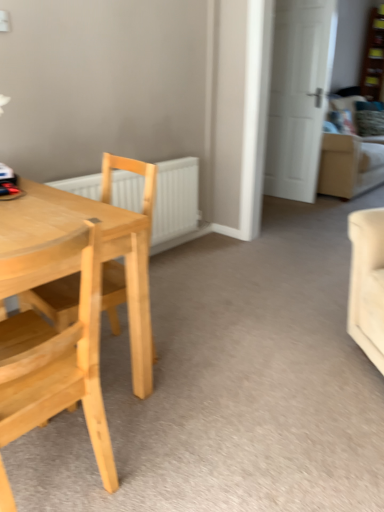
Describe the element at coordinates (63, 373) in the screenshot. I see `light wood chair at left, the 1th chair from the front` at that location.

Locate an element on the screen. beige fabric couch at upper right is located at coordinates (350, 159).

The width and height of the screenshot is (384, 512). What do you see at coordinates (350, 159) in the screenshot? I see `beige fabric couch at upper right` at bounding box center [350, 159].

At what (x,y) coordinates should I click in order to perform the action: click on light wood chair at left, the 1th chair from the front. Please return your answer as a coordinate pair (x, y). This screenshot has width=384, height=512. Looking at the image, I should click on (63, 373).

Is wooden bookshelf at upper right far away from white matte radiator at center?

Indeed, wooden bookshelf at upper right is not near white matte radiator at center.

Image resolution: width=384 pixels, height=512 pixels. Find the location of `radiator in front of the wooden bookshelf at upper right`. radiator in front of the wooden bookshelf at upper right is located at coordinates (175, 199).

Considering the relative sizes of wooden bookshelf at upper right and white matte radiator at center in the image provided, is wooden bookshelf at upper right thinner than white matte radiator at center?

No, wooden bookshelf at upper right is not thinner than white matte radiator at center.

Does wooden bookshelf at upper right have a lesser height compared to white matte radiator at center?

In fact, wooden bookshelf at upper right may be taller than white matte radiator at center.

Which object is wider, natural wood chair at left, positioned as the 1th chair in back-to-front order, or white matte radiator at center?

natural wood chair at left, positioned as the 1th chair in back-to-front order, is wider.

Could you measure the distance between natural wood chair at left, which is the second chair in front-to-back order, and white matte radiator at center?

They are 1.40 meters apart.

Which is behind, natural wood chair at left, which is the second chair in front-to-back order, or white matte radiator at center?

white matte radiator at center.

From the image's perspective, which object appears higher, natural wood chair at left, which is the second chair in front-to-back order, or white matte radiator at center?

white matte radiator at center.

Which is behind, point (307, 91) or point (352, 136)?

The point (352, 136) is behind.

Could beige fabric couch at upper right be considered to be inside white matte door at upper right?

Definitely not — beige fabric couch at upper right is not inside white matte door at upper right.

You are a GUI agent. You are given a task and a screenshot of the screen. Output one action in this format:
    pyautogui.click(x=<x>, y=<y>)
    Task: Click on the couch below the white matte door at upper right (from the image's perspective)
    
    Given the screenshot: What is the action you would take?
    pyautogui.click(x=350, y=159)

From the image's perspective, which is below, light wood chair at left, the 1th chair from the front, or wooden bookshelf at upper right?

light wood chair at left, the 1th chair from the front, is shown below in the image.

Measure the distance between light wood chair at left, the second chair viewed from the back, and wooden bookshelf at upper right.

A distance of 18.60 feet exists between light wood chair at left, the second chair viewed from the back, and wooden bookshelf at upper right.

Which of these two, light wood chair at left, the second chair viewed from the back, or wooden bookshelf at upper right, is smaller?

wooden bookshelf at upper right is smaller.

Would you say light wood chair at left, the 1th chair from the front, is to the left or to the right of wooden bookshelf at upper right in the picture?

light wood chair at left, the 1th chair from the front, is to the left of wooden bookshelf at upper right.

Is natural wood chair at left, positioned as the 1th chair in back-to-front order, not inside light wood chair at left, the second chair viewed from the back?

Absolutely, natural wood chair at left, positioned as the 1th chair in back-to-front order, is external to light wood chair at left, the second chair viewed from the back.

Is point (118, 270) less distant than point (96, 268)?

That is False.

Is natural wood chair at left, which is the second chair in front-to-back order, behind light wood chair at left, the 1th chair from the front?

Yes, natural wood chair at left, which is the second chair in front-to-back order, is further from the viewer.

Does point (82, 191) lie in front of point (325, 30)?

Yes, point (82, 191) is in front of point (325, 30).

Measure the distance between white matte radiator at center and white matte door at upper right.

white matte radiator at center and white matte door at upper right are 4.99 feet apart from each other.

From a real-world perspective, is white matte radiator at center on top of white matte door at upper right?

No, from a real-world perspective, white matte radiator at center is not over white matte door at upper right

Is white matte radiator at center shorter than white matte door at upper right?

Correct, white matte radiator at center is not as tall as white matte door at upper right.

Which of these two, white matte radiator at center or light wood chair at left, the 1th chair from the front, stands taller?

light wood chair at left, the 1th chair from the front.

Is white matte radiator at center not inside light wood chair at left, the 1th chair from the front?

white matte radiator at center lies outside light wood chair at left, the 1th chair from the front,'s area.

Is white matte radiator at center far from light wood chair at left, the 1th chair from the front?

white matte radiator at center is far away from light wood chair at left, the 1th chair from the front.

Consider the image. Which is more to the left, white matte radiator at center or light wood chair at left, the 1th chair from the front?

From the viewer's perspective, light wood chair at left, the 1th chair from the front, appears more on the left side.

You are a GUI agent. You are given a task and a screenshot of the screen. Output one action in this format:
    pyautogui.click(x=<x>, y=<y>)
    Task: Click on the shelf to the right of white matte radiator at center
    The image size is (384, 512).
    Given the screenshot: What is the action you would take?
    pyautogui.click(x=373, y=57)

Locate an element on the screen. chair that is the 1st one when counting downward from the white matte radiator at center (from the image's perspective) is located at coordinates (56, 300).

From the image, which object appears to be farther from white matte door at upper right, light wood chair at left, the 1th chair from the front, or white matte radiator at center?

The object further to white matte door at upper right is light wood chair at left, the 1th chair from the front.

Considering their positions, is wooden bookshelf at upper right positioned further to beige fabric couch at upper right than light wood chair at left, the 1th chair from the front?

Among the two, light wood chair at left, the 1th chair from the front, is located further to beige fabric couch at upper right.

From the image, which object appears to be nearer to wooden bookshelf at upper right, light wood chair at left, the 1th chair from the front, or natural wood chair at left, which is the second chair in front-to-back order?

natural wood chair at left, which is the second chair in front-to-back order, lies closer to wooden bookshelf at upper right than the other object.

Which object lies further to the anchor point white matte radiator at center, beige fabric couch at upper right or light wood chair at left, the 1th chair from the front?

beige fabric couch at upper right is further to white matte radiator at center.

Estimate the real-world distances between objects in this image. Which object is further from white matte radiator at center, beige fabric couch at upper right or wooden bookshelf at upper right?

wooden bookshelf at upper right.

Considering their positions, is wooden bookshelf at upper right positioned closer to white matte door at upper right than natural wood chair at left, positioned as the 1th chair in back-to-front order?

wooden bookshelf at upper right.

Estimate the real-world distances between objects in this image. Which object is further from white matte door at upper right, wooden bookshelf at upper right or beige fabric couch at upper right?

The object further to white matte door at upper right is wooden bookshelf at upper right.

Considering their positions, is white matte door at upper right positioned further to wooden bookshelf at upper right than light wood chair at left, the 1th chair from the front?

The object further to wooden bookshelf at upper right is light wood chair at left, the 1th chair from the front.

Where is `radiator between natural wood chair at left, which is the second chair in front-to-back order, and white matte door at upper right, along the z-axis`? radiator between natural wood chair at left, which is the second chair in front-to-back order, and white matte door at upper right, along the z-axis is located at coordinates (175, 199).

This screenshot has width=384, height=512. What are the coordinates of `couch between natural wood chair at left, positioned as the 1th chair in back-to-front order, and wooden bookshelf at upper right from front to back` in the screenshot? It's located at tap(350, 159).

Find the location of a particular element. radiator between natural wood chair at left, positioned as the 1th chair in back-to-front order, and wooden bookshelf at upper right from front to back is located at coordinates [175, 199].

Where is `door between light wood chair at left, the second chair viewed from the back, and beige fabric couch at upper right in the front-back direction`? door between light wood chair at left, the second chair viewed from the back, and beige fabric couch at upper right in the front-back direction is located at coordinates (298, 95).